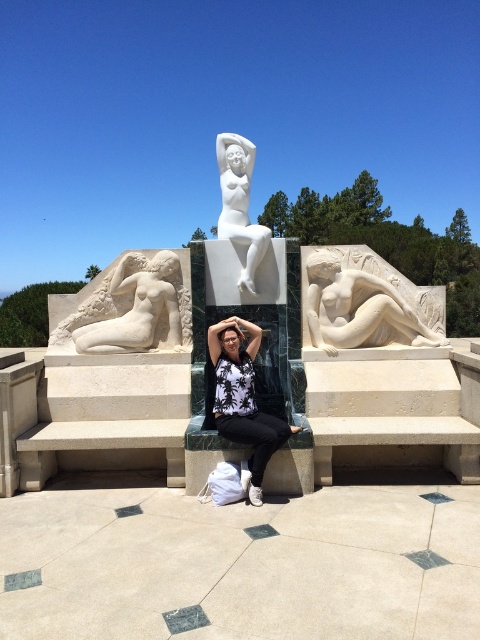
Question: Which of these objects is positioned farthest from the white marble reclining figure at center?

Choices:
 (A) white marble reclining figure at left
 (B) white fabric bag at center

Answer: (A)

Question: Can you confirm if white fabric bag at center is positioned above white marble reclining figure at left?

Choices:
 (A) no
 (B) yes

Answer: (A)

Question: From the image, what is the correct spatial relationship of white fabric bag at center in relation to white marble statue at center?

Choices:
 (A) right
 (B) left

Answer: (A)

Question: Considering the real-world distances, which object is closest to the white marble statue at center?

Choices:
 (A) white fabric bag at center
 (B) white marble reclining figure at left

Answer: (B)

Question: Which object is farther from the camera taking this photo?

Choices:
 (A) white marble reclining figure at center
 (B) white marble reclining figure at left

Answer: (A)

Question: Can you confirm if white fabric bag at center is thinner than white marble statue at center?

Choices:
 (A) yes
 (B) no

Answer: (B)